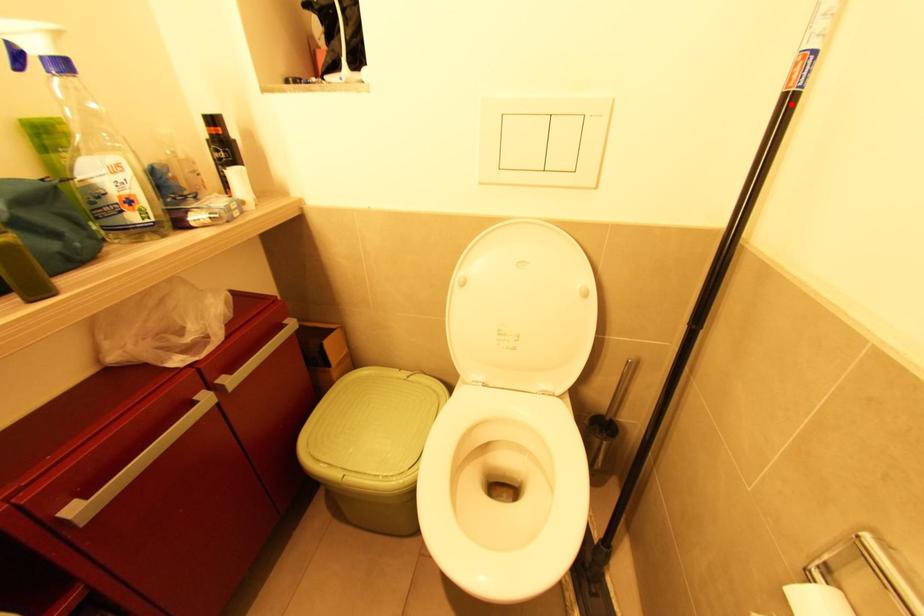
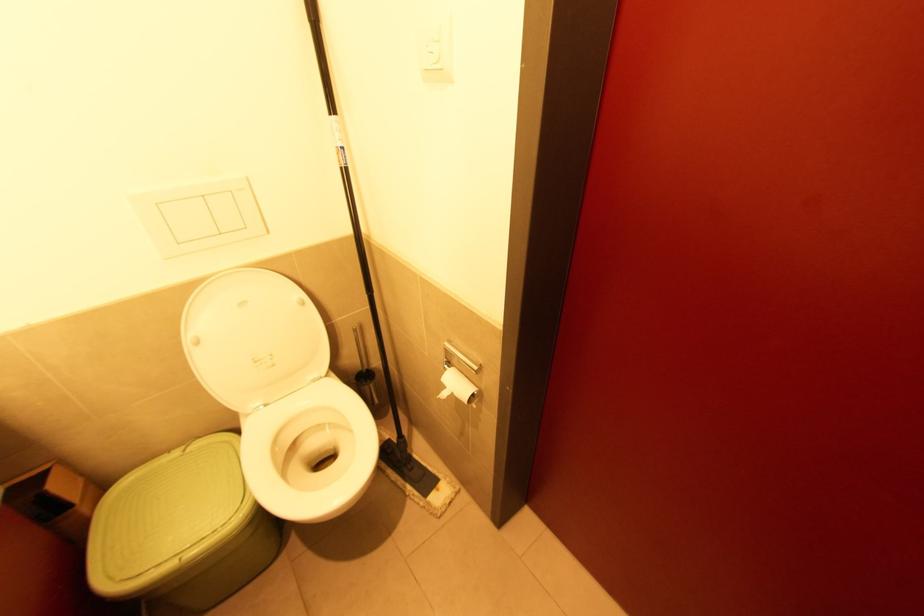
Question: I am providing you with two images of the same scene from different viewpoints. A red point is marked on the first image. Can you still see the location of the red point in image 2?

Choices:
 (A) Yes
 (B) No

Answer: (A)